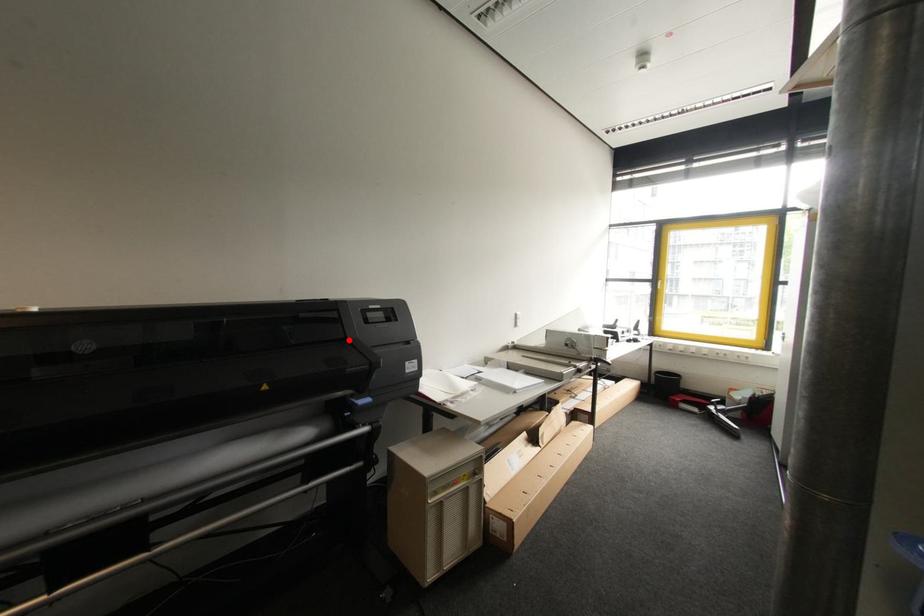
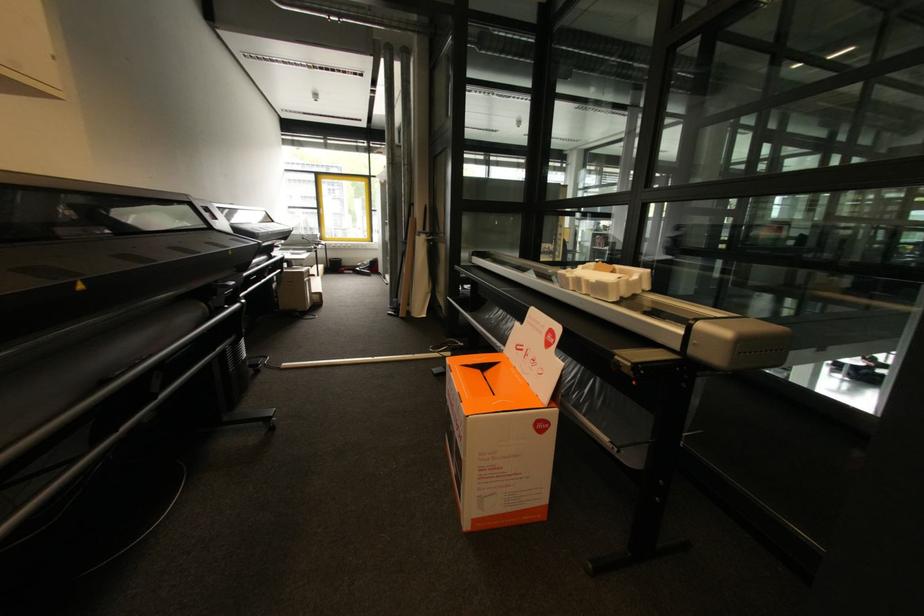
Question: I am providing you with two images of the same scene from different viewpoints. A red point is marked on the first image. Can you still see the location of the red point in image 2?

Choices:
 (A) Yes
 (B) No

Answer: (B)